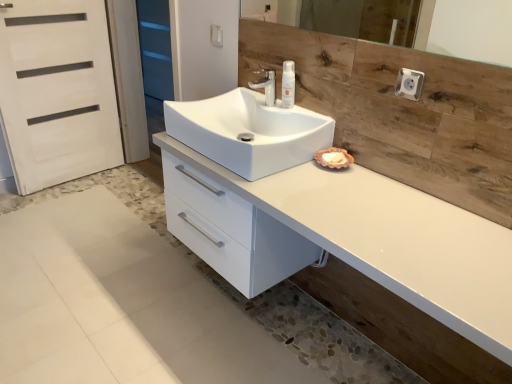
Question: Is white plastic socket at upper right wider or thinner than white glossy sink at center?

Choices:
 (A) wide
 (B) thin

Answer: (B)

Question: From the image's perspective, relative to white glossy sink at center, is white plastic socket at upper right above or below?

Choices:
 (A) above
 (B) below

Answer: (A)

Question: Which is nearer to the blue matte screen door at upper left, the 2th screen door when ordered from bottom to top?

Choices:
 (A) wooden mirror at upper center
 (B) white glossy cabinet at center
 (C) white plastic bottle at upper center
 (D) white matte door at left, the second screen door positioned from the back
 (E) matte silver faucet at center

Answer: (D)

Question: Considering the real-world distances, which object is farthest from the white glossy sink at center?

Choices:
 (A) white plastic socket at upper right
 (B) wooden mirror at upper center
 (C) matte silver faucet at center
 (D) white plastic bottle at upper center
 (E) white matte door at left, the second screen door positioned from the back

Answer: (B)